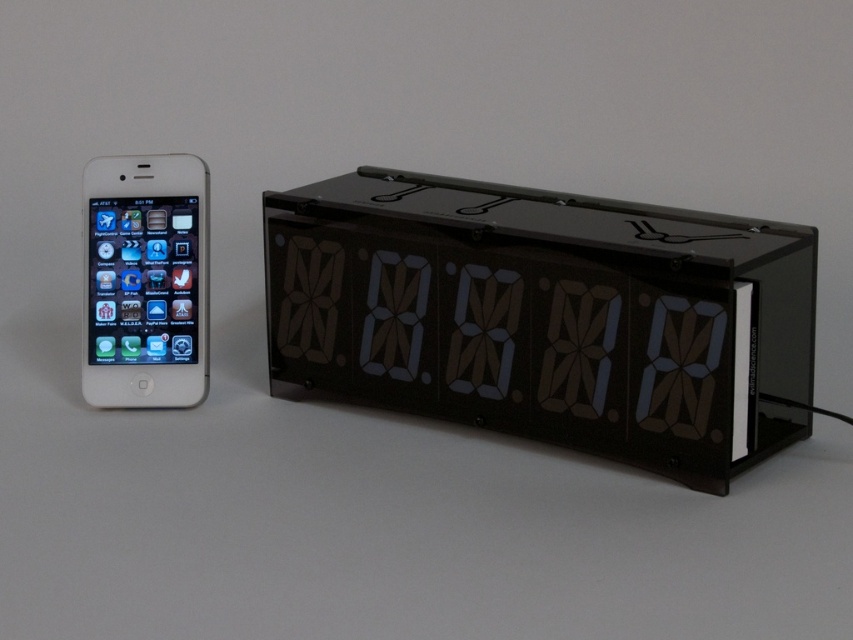
Does point (403, 296) lie behind point (204, 209)?

That is False.

Which is more to the left, black plastic digital clock at center or white glossy ipod at left?

From the viewer's perspective, white glossy ipod at left appears more on the left side.

Who is more forward, (x=364, y=321) or (x=152, y=216)?

Point (x=152, y=216) is in front.

Where is `black plastic digital clock at center`? black plastic digital clock at center is located at coordinates (547, 316).